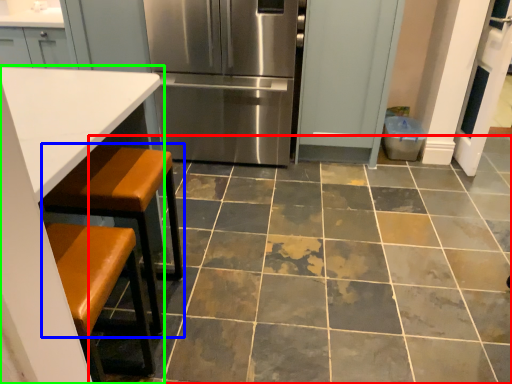
Question: Which object is positioned farthest from ceramic tile (highlighted by a red box)? Select from step stool (highlighted by a blue box) and table (highlighted by a green box).

Choices:
 (A) step stool
 (B) table

Answer: (B)